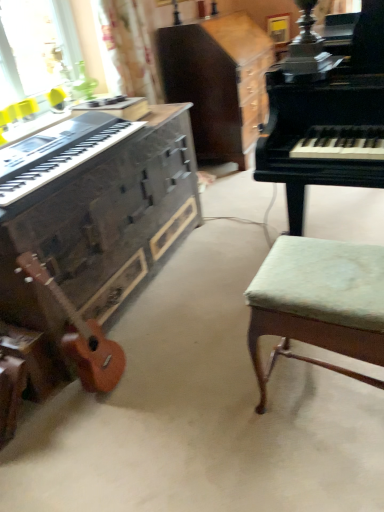
Question: Is wooden acoustic guitar at lower left oriented towards wooden piano at left, which ranks as the 2th piano in right-to-left order?

Choices:
 (A) yes
 (B) no

Answer: (B)

Question: Can wooden piano at left, which ranks as the 2th piano in right-to-left order, be found inside wooden acoustic guitar at lower left?

Choices:
 (A) yes
 (B) no

Answer: (B)

Question: Is wooden acoustic guitar at lower left directly adjacent to wooden piano at left, which ranks as the 2th piano in right-to-left order?

Choices:
 (A) no
 (B) yes

Answer: (A)

Question: Considering the relative sizes of wooden acoustic guitar at lower left and wooden piano at left, arranged as the 1th piano when viewed from the left, in the image provided, is wooden acoustic guitar at lower left wider than wooden piano at left, arranged as the 1th piano when viewed from the left,?

Choices:
 (A) yes
 (B) no

Answer: (B)

Question: Is wooden acoustic guitar at lower left turned away from wooden piano at left, which ranks as the 2th piano in right-to-left order?

Choices:
 (A) yes
 (B) no

Answer: (A)

Question: Does wooden acoustic guitar at lower left have a larger size compared to wooden piano at left, arranged as the 1th piano when viewed from the left?

Choices:
 (A) yes
 (B) no

Answer: (B)

Question: Is wooden acoustic guitar at lower left far away from matte black keyboard at left?

Choices:
 (A) yes
 (B) no

Answer: (B)

Question: Is wooden acoustic guitar at lower left oriented away from matte black keyboard at left?

Choices:
 (A) yes
 (B) no

Answer: (B)

Question: Is wooden acoustic guitar at lower left bigger than matte black keyboard at left?

Choices:
 (A) yes
 (B) no

Answer: (B)

Question: Is wooden acoustic guitar at lower left smaller than matte black keyboard at left?

Choices:
 (A) no
 (B) yes

Answer: (B)

Question: Does wooden acoustic guitar at lower left have a greater height compared to matte black keyboard at left?

Choices:
 (A) yes
 (B) no

Answer: (A)

Question: From a real-world perspective, is wooden acoustic guitar at lower left over matte black keyboard at left?

Choices:
 (A) yes
 (B) no

Answer: (B)

Question: Is green fabric stool at right taller than matte black keyboard at left?

Choices:
 (A) no
 (B) yes

Answer: (B)